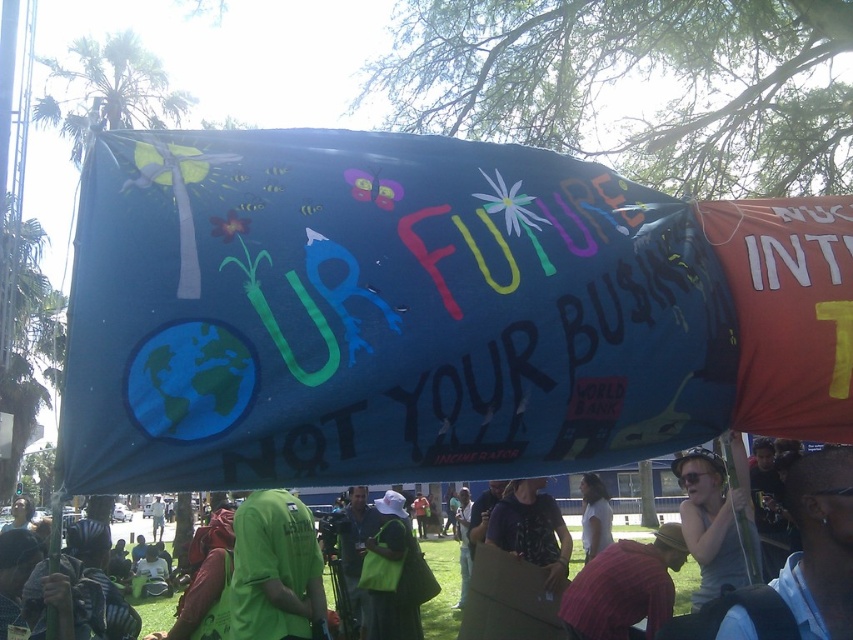
You are a photographer standing in the protest area. You see two points in the image at coordinates point (x=601, y=570) and point (x=138, y=611). Which point is closer to you?

Point (x=601, y=570) is closer to the viewer than point (x=138, y=611).

Based on the coordinates provided, which object is located at point [276,570] in the scene?

The green fabric shirt at lower left is located at point [276,570].